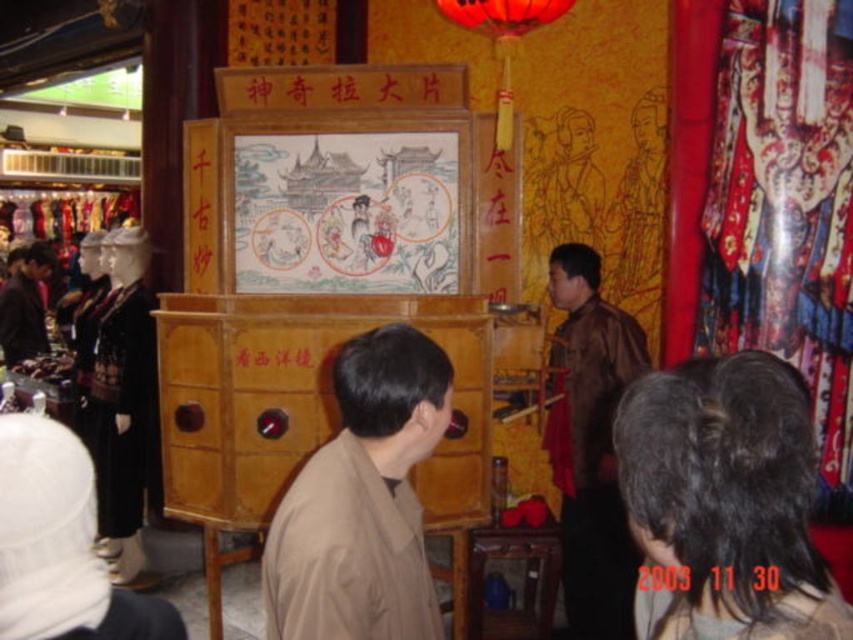
Is point (770, 634) farther from camera compared to point (9, 300)?

No.

Is black hair at upper center above brown leather jacket at left?

No, black hair at upper center is not above brown leather jacket at left.

You are a GUI agent. You are given a task and a screenshot of the screen. Output one action in this format:
    pyautogui.click(x=<x>, y=<y>)
    Task: Click on the black hair at upper center
    The width and height of the screenshot is (853, 640).
    Given the screenshot: What is the action you would take?
    [724, 502]

Locate an element on the screen. black hair at upper center is located at coordinates (724, 502).

Is brown leather jacket at left to the left of black paper at center from the viewer's perspective?

Yes, brown leather jacket at left is to the left of black paper at center.

Is brown leather jacket at left shorter than black paper at center?

No, brown leather jacket at left is not shorter than black paper at center.

This screenshot has width=853, height=640. Describe the element at coordinates (24, 307) in the screenshot. I see `brown leather jacket at left` at that location.

The image size is (853, 640). Identify the location of brown leather jacket at left. (24, 307).

Which is above, brown leather jacket at center or brown leather jacket at left?

Positioned higher is brown leather jacket at left.

Is brown leather jacket at center taller than brown leather jacket at left?

Indeed, brown leather jacket at center has a greater height compared to brown leather jacket at left.

Does point (614, 588) come farther from viewer compared to point (45, 330)?

No, (614, 588) is in front of (45, 330).

Identify the location of brown leather jacket at center. (590, 444).